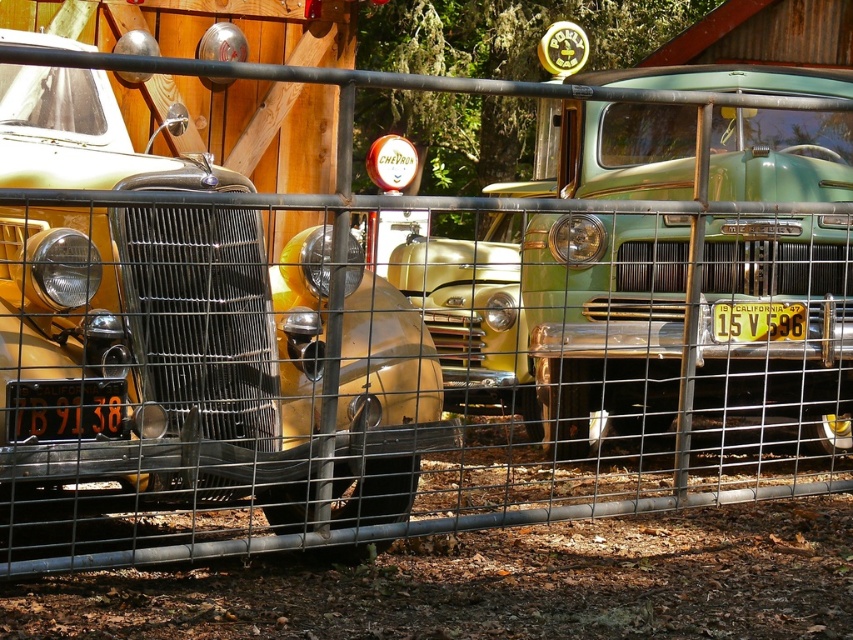
Can you confirm if matte yellow car at left is taller than yellow metal license plate at center?

Yes, matte yellow car at left is taller than yellow metal license plate at center.

Does matte yellow car at left come behind yellow metal license plate at center?

No, matte yellow car at left is closer to the viewer.

This screenshot has height=640, width=853. Describe the element at coordinates (218, 364) in the screenshot. I see `matte yellow car at left` at that location.

Identify the location of matte yellow car at left. The width and height of the screenshot is (853, 640). (218, 364).

Is point (387, 468) behind point (103, 384)?

Yes, it is behind point (103, 384).

Who is more forward, (x=102, y=234) or (x=91, y=397)?

Point (x=91, y=397) is in front.

Between point (376, 403) and point (20, 440), which one is positioned in front?

Point (20, 440)

Find the location of a particular element. The image size is (853, 640). matte yellow car at left is located at coordinates (218, 364).

Is black metal license plate at lower left bigger than yellow metal license plate at center?

Actually, black metal license plate at lower left might be smaller than yellow metal license plate at center.

The height and width of the screenshot is (640, 853). I want to click on black metal license plate at lower left, so 64,410.